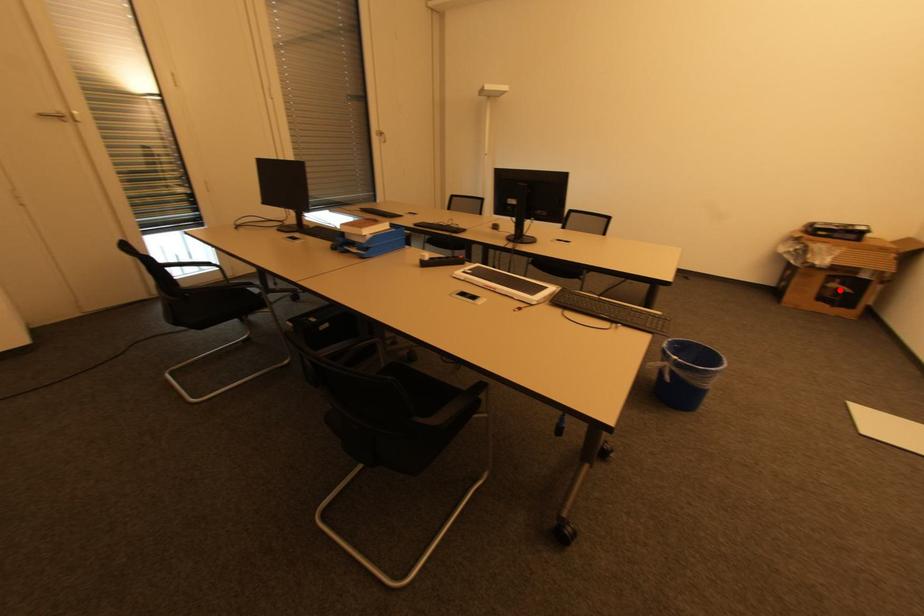
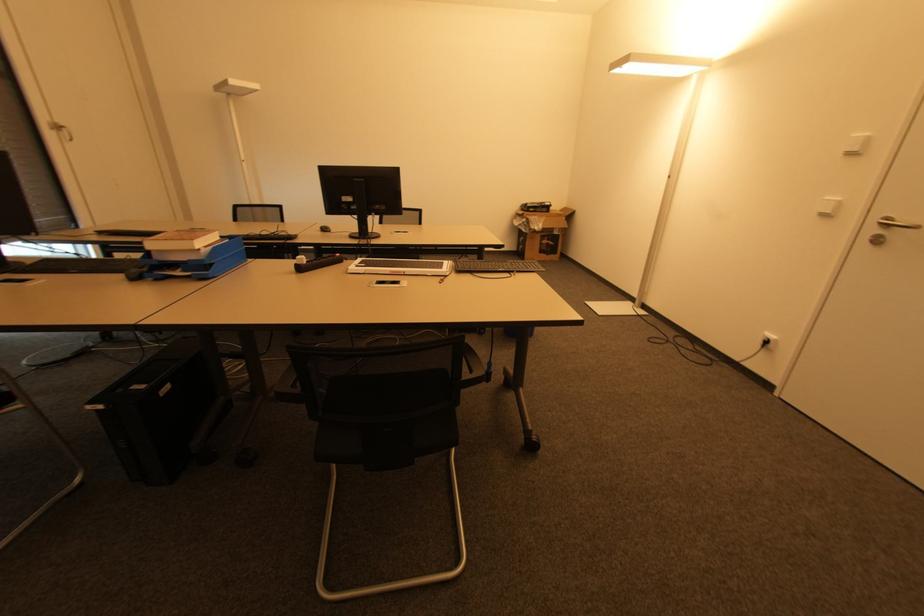
Question: I am providing you with two images of the same scene from different viewpoints. A red point is shown in image1. For the corresponding object point in image2, is it positioned nearer or farther from the camera?

Choices:
 (A) Nearer
 (B) Farther

Answer: (A)